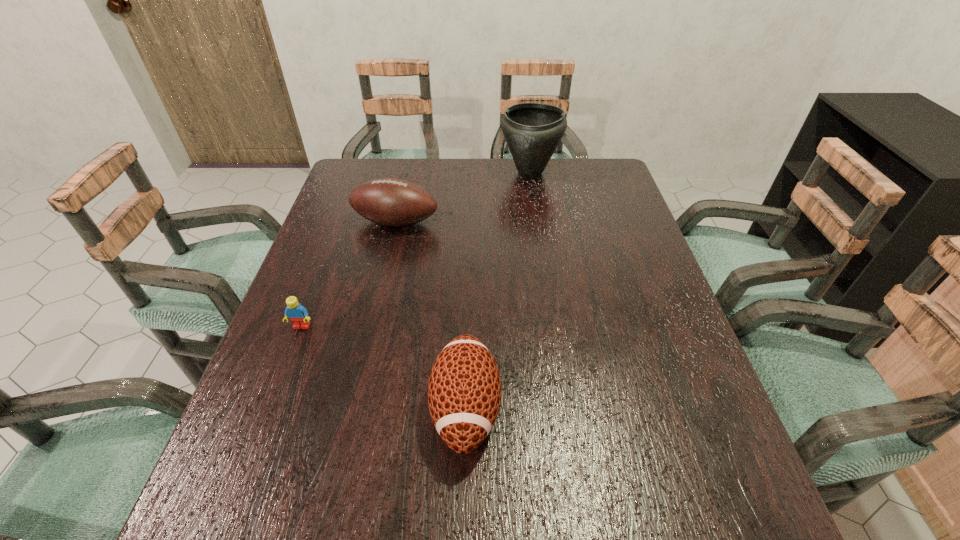
At what (x,y) coordinates should I click in order to perform the action: click on urn. Please return your answer as a coordinate pair (x, y). The image size is (960, 540). Looking at the image, I should click on (x=532, y=131).

The image size is (960, 540). I want to click on the tallest object, so click(x=532, y=131).

Where is `the left football`? Image resolution: width=960 pixels, height=540 pixels. the left football is located at coordinates (392, 202).

This screenshot has width=960, height=540. In order to click on the third object from right to left in this screenshot , I will do `click(392, 202)`.

Where is `the nearer football`? This screenshot has height=540, width=960. the nearer football is located at coordinates (464, 390).

Find the location of a particular element. The height and width of the screenshot is (540, 960). the third object from left to right is located at coordinates (464, 390).

This screenshot has width=960, height=540. Find the location of `Lego`. Lego is located at coordinates (298, 315).

Locate an element on the screen. Image resolution: width=960 pixels, height=540 pixels. the second nearest object is located at coordinates (298, 315).

At what (x,y) coordinates should I click in order to perform the action: click on free space located 0.290m on the front of the farthest object. Please return your answer as a coordinate pair (x, y). This screenshot has width=960, height=540. Looking at the image, I should click on (541, 247).

Where is `free region located 0.380m on the front of the second farthest object`? free region located 0.380m on the front of the second farthest object is located at coordinates (368, 346).